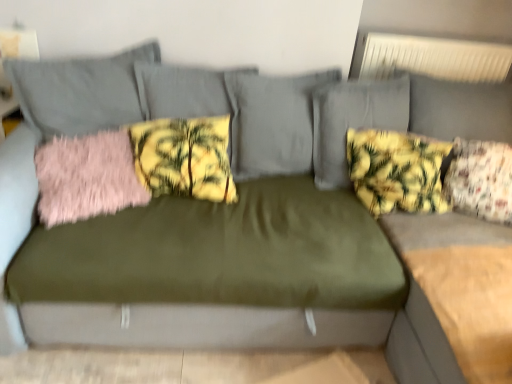
This screenshot has height=384, width=512. What do you see at coordinates (184, 158) in the screenshot?
I see `yellow floral fabric pillow at center, which is the 3th pillow in right-to-left order` at bounding box center [184, 158].

The height and width of the screenshot is (384, 512). I want to click on floral fabric pillow at right, which ranks as the first pillow in right-to-left order, so click(x=480, y=179).

I want to click on pink fluffy pillow at left, which is counted as the 1th pillow, starting from the left, so click(87, 177).

Considering the points (484, 166) and (368, 144), which point is in front, point (484, 166) or point (368, 144)?

Point (484, 166)

Is floral fabric pillow at right, which ranks as the first pillow in right-to-left order, not close to yellow floral fabric pillow at upper right, which is the 3th pillow in left-to-right order?

floral fabric pillow at right, which ranks as the first pillow in right-to-left order, is actually quite close to yellow floral fabric pillow at upper right, which is the 3th pillow in left-to-right order.

Identify the location of pillow that is the 2nd one when counting downward from the yellow floral fabric pillow at upper right, which is the 2th pillow from right to left (from the image's perspective). (480, 179).

Find the location of a particular element. pillow that is the 2nd object to the right of the yellow floral fabric pillow at center, which is the 3th pillow in right-to-left order, starting at the anchor is located at coordinates (480, 179).

Based on the photo, is yellow floral fabric pillow at center, which is the 3th pillow in right-to-left order, bigger or smaller than floral fabric pillow at right, which ranks as the first pillow in right-to-left order?

Considering their sizes, yellow floral fabric pillow at center, which is the 3th pillow in right-to-left order, takes up less space than floral fabric pillow at right, which ranks as the first pillow in right-to-left order.

Is yellow floral fabric pillow at center, which appears as the second pillow when viewed from the left, not within floral fabric pillow at right, which ranks as the first pillow in right-to-left order?

yellow floral fabric pillow at center, which appears as the second pillow when viewed from the left, lies outside floral fabric pillow at right, which ranks as the first pillow in right-to-left order,'s area.

Can you confirm if yellow floral fabric pillow at upper right, which is the 3th pillow in left-to-right order, is bigger than floral fabric pillow at right, which ranks as the first pillow in right-to-left order?

Indeed, yellow floral fabric pillow at upper right, which is the 3th pillow in left-to-right order, has a larger size compared to floral fabric pillow at right, which ranks as the first pillow in right-to-left order.

Which object is wider, yellow floral fabric pillow at upper right, which is the 2th pillow from right to left, or floral fabric pillow at right, the 4th pillow in the left-to-right sequence?

With larger width is floral fabric pillow at right, the 4th pillow in the left-to-right sequence.

Is yellow floral fabric pillow at upper right, which is the 2th pillow from right to left, next to floral fabric pillow at right, the 4th pillow in the left-to-right sequence, and touching it?

yellow floral fabric pillow at upper right, which is the 2th pillow from right to left, is not next to floral fabric pillow at right, the 4th pillow in the left-to-right sequence, and they're not touching.

Based on the photo, considering the sizes of objects yellow floral fabric pillow at upper right, which is the 2th pillow from right to left, and floral fabric pillow at right, the 4th pillow in the left-to-right sequence, in the image provided, who is shorter, yellow floral fabric pillow at upper right, which is the 2th pillow from right to left, or floral fabric pillow at right, the 4th pillow in the left-to-right sequence,?

With less height is floral fabric pillow at right, the 4th pillow in the left-to-right sequence.

Could you measure the distance between floral fabric pillow at right, which ranks as the first pillow in right-to-left order, and pink fluffy pillow at left, the fourth pillow viewed from the right?

floral fabric pillow at right, which ranks as the first pillow in right-to-left order, is 4.67 feet away from pink fluffy pillow at left, the fourth pillow viewed from the right.

From the image's perspective, is floral fabric pillow at right, the 4th pillow in the left-to-right sequence, under pink fluffy pillow at left, the fourth pillow viewed from the right?

Yes, from the image's perspective, floral fabric pillow at right, the 4th pillow in the left-to-right sequence, is below pink fluffy pillow at left, the fourth pillow viewed from the right.

Does floral fabric pillow at right, the 4th pillow in the left-to-right sequence, lie behind pink fluffy pillow at left, the fourth pillow viewed from the right?

Yes, floral fabric pillow at right, the 4th pillow in the left-to-right sequence, is further from the camera.

Is yellow floral fabric pillow at upper right, which is the 3th pillow in left-to-right order, aimed at pink fluffy pillow at left, the fourth pillow viewed from the right?

No, yellow floral fabric pillow at upper right, which is the 3th pillow in left-to-right order, is not turned towards pink fluffy pillow at left, the fourth pillow viewed from the right.

Between yellow floral fabric pillow at upper right, which is the 3th pillow in left-to-right order, and pink fluffy pillow at left, the fourth pillow viewed from the right, which one has less height?

pink fluffy pillow at left, the fourth pillow viewed from the right, is shorter.

From a real-world perspective, who is located higher, yellow floral fabric pillow at upper right, which is the 3th pillow in left-to-right order, or pink fluffy pillow at left, which is counted as the 1th pillow, starting from the left?

yellow floral fabric pillow at upper right, which is the 3th pillow in left-to-right order, from a real-world perspective.

Is yellow floral fabric pillow at center, which appears as the second pillow when viewed from the left, in front of or behind pink fluffy pillow at left, the fourth pillow viewed from the right, in the image?

Visually, yellow floral fabric pillow at center, which appears as the second pillow when viewed from the left, is located behind pink fluffy pillow at left, the fourth pillow viewed from the right.

Is yellow floral fabric pillow at center, which appears as the second pillow when viewed from the left, turned away from pink fluffy pillow at left, which is counted as the 1th pillow, starting from the left?

No.

This screenshot has height=384, width=512. I want to click on the 1st pillow to the right when counting from the pink fluffy pillow at left, the fourth pillow viewed from the right, so click(x=184, y=158).

Based on their positions, is pink fluffy pillow at left, which is counted as the 1th pillow, starting from the left, located to the left or right of yellow floral fabric pillow at upper right, which is the 3th pillow in left-to-right order?

Based on their positions, pink fluffy pillow at left, which is counted as the 1th pillow, starting from the left, is located to the left of yellow floral fabric pillow at upper right, which is the 3th pillow in left-to-right order.

From the image's perspective, is pink fluffy pillow at left, which is counted as the 1th pillow, starting from the left, located above yellow floral fabric pillow at upper right, which is the 3th pillow in left-to-right order?

No, from the image's perspective, pink fluffy pillow at left, which is counted as the 1th pillow, starting from the left, is not on top of yellow floral fabric pillow at upper right, which is the 3th pillow in left-to-right order.

Is pink fluffy pillow at left, which is counted as the 1th pillow, starting from the left, in contact with yellow floral fabric pillow at upper right, which is the 3th pillow in left-to-right order?

They are not placed beside each other.

Between point (79, 165) and point (354, 138), which one is positioned in front?

Point (79, 165)

You are a GUI agent. You are given a task and a screenshot of the screen. Output one action in this format:
    pyautogui.click(x=<x>, y=<y>)
    Task: Click on the pillow that is on the right side of yellow floral fabric pillow at upper right, which is the 3th pillow in left-to-right order
    This screenshot has width=512, height=384.
    Given the screenshot: What is the action you would take?
    pyautogui.click(x=480, y=179)

Where is `pillow that is above the floral fabric pillow at right, which ranks as the first pillow in right-to-left order (from a real-world perspective)`? This screenshot has height=384, width=512. pillow that is above the floral fabric pillow at right, which ranks as the first pillow in right-to-left order (from a real-world perspective) is located at coordinates (184, 158).

Looking at this image, which object lies nearer to the anchor point pink fluffy pillow at left, which is counted as the 1th pillow, starting from the left, yellow floral fabric pillow at upper right, which is the 3th pillow in left-to-right order, or yellow floral fabric pillow at center, which is the 3th pillow in right-to-left order?

Based on the image, yellow floral fabric pillow at center, which is the 3th pillow in right-to-left order, appears to be nearer to pink fluffy pillow at left, which is counted as the 1th pillow, starting from the left.

Which object lies further to the anchor point pink fluffy pillow at left, which is counted as the 1th pillow, starting from the left, yellow floral fabric pillow at center, which appears as the second pillow when viewed from the left, or floral fabric pillow at right, which ranks as the first pillow in right-to-left order?

Based on the image, floral fabric pillow at right, which ranks as the first pillow in right-to-left order, appears to be further to pink fluffy pillow at left, which is counted as the 1th pillow, starting from the left.

Which object lies nearer to the anchor point floral fabric pillow at right, which ranks as the first pillow in right-to-left order, pink fluffy pillow at left, which is counted as the 1th pillow, starting from the left, or yellow floral fabric pillow at center, which appears as the second pillow when viewed from the left?

yellow floral fabric pillow at center, which appears as the second pillow when viewed from the left, lies closer to floral fabric pillow at right, which ranks as the first pillow in right-to-left order, than the other object.

Considering their positions, is pink fluffy pillow at left, which is counted as the 1th pillow, starting from the left, positioned further to yellow floral fabric pillow at center, which appears as the second pillow when viewed from the left, than floral fabric pillow at right, the 4th pillow in the left-to-right sequence?

floral fabric pillow at right, the 4th pillow in the left-to-right sequence.

Which object lies nearer to the anchor point yellow floral fabric pillow at center, which is the 3th pillow in right-to-left order, yellow floral fabric pillow at upper right, which is the 3th pillow in left-to-right order, or floral fabric pillow at right, which ranks as the first pillow in right-to-left order?

The object closer to yellow floral fabric pillow at center, which is the 3th pillow in right-to-left order, is yellow floral fabric pillow at upper right, which is the 3th pillow in left-to-right order.

Which object lies further to the anchor point yellow floral fabric pillow at upper right, which is the 3th pillow in left-to-right order, yellow floral fabric pillow at center, which appears as the second pillow when viewed from the left, or floral fabric pillow at right, which ranks as the first pillow in right-to-left order?

Among the two, yellow floral fabric pillow at center, which appears as the second pillow when viewed from the left, is located further to yellow floral fabric pillow at upper right, which is the 3th pillow in left-to-right order.

When comparing their distances from pink fluffy pillow at left, which is counted as the 1th pillow, starting from the left, does floral fabric pillow at right, which ranks as the first pillow in right-to-left order, or yellow floral fabric pillow at upper right, which is the 2th pillow from right to left, seem closer?

yellow floral fabric pillow at upper right, which is the 2th pillow from right to left.

Consider the image. Considering their positions, is floral fabric pillow at right, which ranks as the first pillow in right-to-left order, positioned closer to yellow floral fabric pillow at center, which is the 3th pillow in right-to-left order, than pink fluffy pillow at left, which is counted as the 1th pillow, starting from the left?

pink fluffy pillow at left, which is counted as the 1th pillow, starting from the left.

This screenshot has height=384, width=512. Identify the location of pillow between pink fluffy pillow at left, which is counted as the 1th pillow, starting from the left, and yellow floral fabric pillow at upper right, which is the 2th pillow from right to left, from left to right. (184, 158).

This screenshot has height=384, width=512. I want to click on pillow between yellow floral fabric pillow at center, which is the 3th pillow in right-to-left order, and floral fabric pillow at right, which ranks as the first pillow in right-to-left order, so click(397, 171).